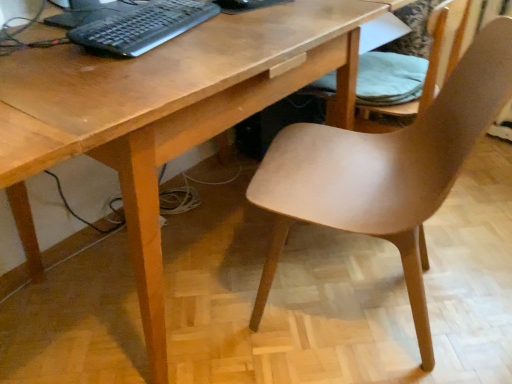
You are a GUI agent. You are given a task and a screenshot of the screen. Output one action in this format:
    pyautogui.click(x=<x>, y=<y>)
    Task: Click on the matte wood chair at lower right, arranged as the second chair when viewed from the front
    
    Given the screenshot: What is the action you would take?
    pyautogui.click(x=416, y=65)

What is the approximate width of matte wood chair at center, arranged as the second chair when viewed from the back?

It is 53.51 centimeters.

Identify the location of matte wood chair at lower right, marked as the 1th chair in a back-to-front arrangement. (416, 65).

From a real-world perspective, who is located higher, matte wood chair at center, arranged as the second chair when viewed from the back, or matte wood chair at lower right, marked as the 1th chair in a back-to-front arrangement?

matte wood chair at lower right, marked as the 1th chair in a back-to-front arrangement, from a real-world perspective.

Which is less distant, (407, 278) or (433, 53)?

Point (407, 278) is positioned closer to the camera compared to point (433, 53).

From the picture: Can you confirm if matte wood chair at center, which is the 1th chair from front to back, is taller than matte wood chair at lower right, marked as the 1th chair in a back-to-front arrangement?

Indeed, matte wood chair at center, which is the 1th chair from front to back, has a greater height compared to matte wood chair at lower right, marked as the 1th chair in a back-to-front arrangement.

How many degrees apart are the facing directions of matte wood chair at center, which is the 1th chair from front to back, and black plastic keyboard at upper left?

The angular difference between matte wood chair at center, which is the 1th chair from front to back, and black plastic keyboard at upper left is 177 degrees.

Consider the image. From the image's perspective, would you say matte wood chair at center, arranged as the second chair when viewed from the back, is shown under black plastic keyboard at upper left?

Correct, matte wood chair at center, arranged as the second chair when viewed from the back, appears lower than black plastic keyboard at upper left in the image.

Is the depth of matte wood chair at center, which is the 1th chair from front to back, greater than that of black plastic keyboard at upper left?

No, matte wood chair at center, which is the 1th chair from front to back, is in front of black plastic keyboard at upper left.

Find the location of `chair in front of the black plastic keyboard at upper left`. chair in front of the black plastic keyboard at upper left is located at coordinates (385, 171).

From the image's perspective, which is above, black plastic keyboard at upper left or matte wood chair at lower right, marked as the 1th chair in a back-to-front arrangement?

black plastic keyboard at upper left is shown above in the image.

Is black plastic keyboard at upper left positioned with its back to matte wood chair at lower right, marked as the 1th chair in a back-to-front arrangement?

No, black plastic keyboard at upper left is not facing away from matte wood chair at lower right, marked as the 1th chair in a back-to-front arrangement.

Looking at this image, is matte wood chair at lower right, marked as the 1th chair in a back-to-front arrangement, a part of black plastic keyboard at upper left?

That's incorrect, matte wood chair at lower right, marked as the 1th chair in a back-to-front arrangement, is not inside black plastic keyboard at upper left.

In the scene shown: Which is more distant, (x=157, y=14) or (x=388, y=92)?

The point (x=388, y=92) is farther from the camera.

From their relative heights in the image, would you say matte wood chair at lower right, marked as the 1th chair in a back-to-front arrangement, is taller or shorter than matte wood chair at center, arranged as the second chair when viewed from the back?

Clearly, matte wood chair at lower right, marked as the 1th chair in a back-to-front arrangement, is shorter compared to matte wood chair at center, arranged as the second chair when viewed from the back.

Is point (320, 90) closer to camera compared to point (317, 193)?

No, (320, 90) is further to viewer.

From a real-world perspective, is matte wood chair at lower right, arranged as the second chair when viewed from the front, physically located above or below matte wood chair at center, arranged as the second chair when viewed from the back?

Clearly, from a real-world perspective, matte wood chair at lower right, arranged as the second chair when viewed from the front, is above matte wood chair at center, arranged as the second chair when viewed from the back.

How far apart are matte wood chair at lower right, marked as the 1th chair in a back-to-front arrangement, and matte wood chair at center, arranged as the second chair when viewed from the back?

14.08 inches.

How much distance is there between matte wood chair at lower right, arranged as the second chair when viewed from the front, and black plastic keyboard at upper left?

They are 28.70 inches apart.

Can you see matte wood chair at lower right, arranged as the second chair when viewed from the front, touching black plastic keyboard at upper left?

matte wood chair at lower right, arranged as the second chair when viewed from the front, and black plastic keyboard at upper left are clearly separated.

From the picture: Which point is more distant from viewer, [429,22] or [96,21]?

Positioned behind is point [429,22].

Does matte wood chair at lower right, arranged as the second chair when viewed from the front, have a greater height compared to black plastic keyboard at upper left?

Yes.

Is black plastic keyboard at upper left outside of matte wood chair at center, which is the 1th chair from front to back?

Yes.

Considering the relative sizes of black plastic keyboard at upper left and matte wood chair at center, arranged as the second chair when viewed from the back, in the image provided, is black plastic keyboard at upper left wider than matte wood chair at center, arranged as the second chair when viewed from the back,?

In fact, black plastic keyboard at upper left might be narrower than matte wood chair at center, arranged as the second chair when viewed from the back.

Is black plastic keyboard at upper left not near matte wood chair at center, arranged as the second chair when viewed from the back?

No, there isn't a large distance between black plastic keyboard at upper left and matte wood chair at center, arranged as the second chair when viewed from the back.

Image resolution: width=512 pixels, height=384 pixels. There is a matte wood chair at center, which is the 1th chair from front to back. Find the location of `chair above it (from a real-world perspective)`. chair above it (from a real-world perspective) is located at coordinates (416, 65).

From a real-world perspective, count 2nd chairs downward from the black plastic keyboard at upper left and point to it. Please provide its 2D coordinates.

[(385, 171)]

From the image, which object appears to be nearer to matte wood chair at center, which is the 1th chair from front to back, matte wood chair at lower right, arranged as the second chair when viewed from the front, or black plastic keyboard at upper left?

Based on the image, matte wood chair at lower right, arranged as the second chair when viewed from the front, appears to be nearer to matte wood chair at center, which is the 1th chair from front to back.

When comparing their distances from matte wood chair at center, which is the 1th chair from front to back, does black plastic keyboard at upper left or matte wood chair at lower right, marked as the 1th chair in a back-to-front arrangement, seem closer?

matte wood chair at lower right, marked as the 1th chair in a back-to-front arrangement, is positioned closer to the anchor matte wood chair at center, which is the 1th chair from front to back.

When comparing their distances from black plastic keyboard at upper left, does matte wood chair at lower right, arranged as the second chair when viewed from the front, or matte wood chair at center, arranged as the second chair when viewed from the back, seem further?

matte wood chair at lower right, arranged as the second chair when viewed from the front, is positioned further to the anchor black plastic keyboard at upper left.

When comparing their distances from matte wood chair at lower right, marked as the 1th chair in a back-to-front arrangement, does matte wood chair at center, which is the 1th chair from front to back, or black plastic keyboard at upper left seem closer?

The object closer to matte wood chair at lower right, marked as the 1th chair in a back-to-front arrangement, is matte wood chair at center, which is the 1th chair from front to back.

Looking at this image, looking at the image, which one is located closer to black plastic keyboard at upper left, matte wood chair at center, arranged as the second chair when viewed from the back, or matte wood chair at lower right, marked as the 1th chair in a back-to-front arrangement?

Based on the image, matte wood chair at center, arranged as the second chair when viewed from the back, appears to be nearer to black plastic keyboard at upper left.

Based on their spatial positions, is black plastic keyboard at upper left or matte wood chair at center, arranged as the second chair when viewed from the back, closer to matte wood chair at lower right, marked as the 1th chair in a back-to-front arrangement?

The object closer to matte wood chair at lower right, marked as the 1th chair in a back-to-front arrangement, is matte wood chair at center, arranged as the second chair when viewed from the back.

Image resolution: width=512 pixels, height=384 pixels. In order to click on chair located between black plastic keyboard at upper left and matte wood chair at lower right, arranged as the second chair when viewed from the front, in the left-right direction in this screenshot , I will do `click(385, 171)`.